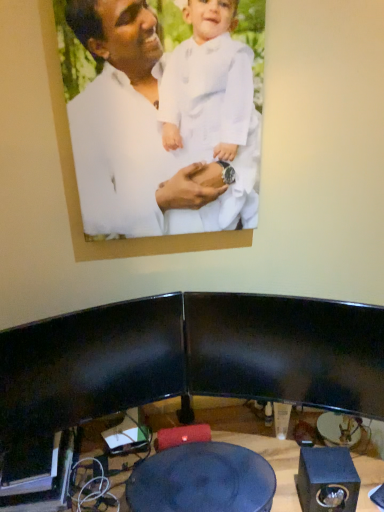
Identify the location of blue glossy table at center. The image size is (384, 512). (202, 480).

Is white matte picture frame at upper center at the right side of black matte speaker at lower right?

No, white matte picture frame at upper center is not to the right of black matte speaker at lower right.

Is white matte picture frame at upper center oriented towards black matte speaker at lower right?

No, white matte picture frame at upper center is not aimed at black matte speaker at lower right.

Does white matte picture frame at upper center have a greater width compared to black matte speaker at lower right?

In fact, white matte picture frame at upper center might be narrower than black matte speaker at lower right.

You are a GUI agent. You are given a task and a screenshot of the screen. Output one action in this format:
    pyautogui.click(x=<x>, y=<y>)
    Task: Click on the picture frame above the black matte speaker at lower right (from a real-world perspective)
    This screenshot has width=384, height=512.
    Given the screenshot: What is the action you would take?
    pyautogui.click(x=127, y=148)

How many degrees apart are the facing directions of white matte picture frame at upper center and blue glossy table at center?

The angle between the facing direction of white matte picture frame at upper center and the facing direction of blue glossy table at center is 2.78 degrees.

Considering the sizes of objects white matte picture frame at upper center and blue glossy table at center in the image provided, who is wider, white matte picture frame at upper center or blue glossy table at center?

With larger width is blue glossy table at center.

Is white matte picture frame at upper center turned away from blue glossy table at center?

No, white matte picture frame at upper center's orientation is not away from blue glossy table at center.

Locate an element on the screen. This screenshot has height=512, width=384. round table directly beneath the white matte picture frame at upper center (from a real-world perspective) is located at coordinates (202, 480).

Is blue glossy table at center far away from white matte picture frame at upper center?

No.

Which of these two, blue glossy table at center or white matte picture frame at upper center, stands taller?

white matte picture frame at upper center is taller.

Which of these two, blue glossy table at center or white matte picture frame at upper center, is thinner?

white matte picture frame at upper center.

Does point (212, 447) come in front of point (161, 221)?

No, it is behind (161, 221).

Considering the sizes of objects blue glossy table at center and black matte speaker at lower right in the image provided, who is smaller, blue glossy table at center or black matte speaker at lower right?

Smaller between the two is black matte speaker at lower right.

Which point is more distant from viewer, (155, 501) or (332, 453)?

Positioned behind is point (332, 453).

Would you consider blue glossy table at center to be distant from black matte speaker at lower right?

Actually, blue glossy table at center and black matte speaker at lower right are a little close together.

From a real-world perspective, is blue glossy table at center over black matte speaker at lower right?

No, from a real-world perspective, blue glossy table at center is not on top of black matte speaker at lower right.

Is black matte speaker at lower right in front of blue glossy table at center?

No, black matte speaker at lower right is further to the viewer.

From a real-world perspective, is black matte speaker at lower right located higher than blue glossy table at center?

Yes, from a real-world perspective, black matte speaker at lower right is on top of blue glossy table at center.

From the image's perspective, relative to blue glossy table at center, is black matte speaker at lower right above or below?

black matte speaker at lower right is situated higher than blue glossy table at center in the image.

Is the surface of black matte speaker at lower right in direct contact with blue glossy table at center?

No, black matte speaker at lower right is not making contact with blue glossy table at center.

Which is more to the left, black matte speaker at lower right or white matte picture frame at upper center?

white matte picture frame at upper center.

Would you consider black matte speaker at lower right to be distant from white matte picture frame at upper center?

Actually, black matte speaker at lower right and white matte picture frame at upper center are a little close together.

From the image's perspective, does black matte speaker at lower right appear lower than white matte picture frame at upper center?

Indeed, from the image's perspective, black matte speaker at lower right is shown beneath white matte picture frame at upper center.

Would you say black matte speaker at lower right is inside or outside white matte picture frame at upper center?

The correct answer is: outside.

What are the coordinates of `speaker below the white matte picture frame at upper center (from the image's perspective)` in the screenshot? It's located at (327, 480).

This screenshot has height=512, width=384. In order to click on picture frame that is above the blue glossy table at center (from a real-world perspective) in this screenshot , I will do `click(127, 148)`.

From the image, which object appears to be farther from blue glossy table at center, black matte speaker at lower right or white matte picture frame at upper center?

white matte picture frame at upper center lies further to blue glossy table at center than the other object.

Which object lies further to the anchor point white matte picture frame at upper center, blue glossy table at center or black matte speaker at lower right?

black matte speaker at lower right is positioned further to the anchor white matte picture frame at upper center.

Considering their positions, is blue glossy table at center positioned further to black matte speaker at lower right than white matte picture frame at upper center?

Based on the image, white matte picture frame at upper center appears to be further to black matte speaker at lower right.

Based on their spatial positions, is black matte speaker at lower right or blue glossy table at center closer to white matte picture frame at upper center?

blue glossy table at center is closer to white matte picture frame at upper center.

Looking at the image, which one is located further to blue glossy table at center, white matte picture frame at upper center or black matte speaker at lower right?

white matte picture frame at upper center.

Considering their positions, is white matte picture frame at upper center positioned further to black matte speaker at lower right than blue glossy table at center?

white matte picture frame at upper center.

Find the location of a particular element. The height and width of the screenshot is (512, 384). speaker that lies between white matte picture frame at upper center and blue glossy table at center from top to bottom is located at coordinates (327, 480).